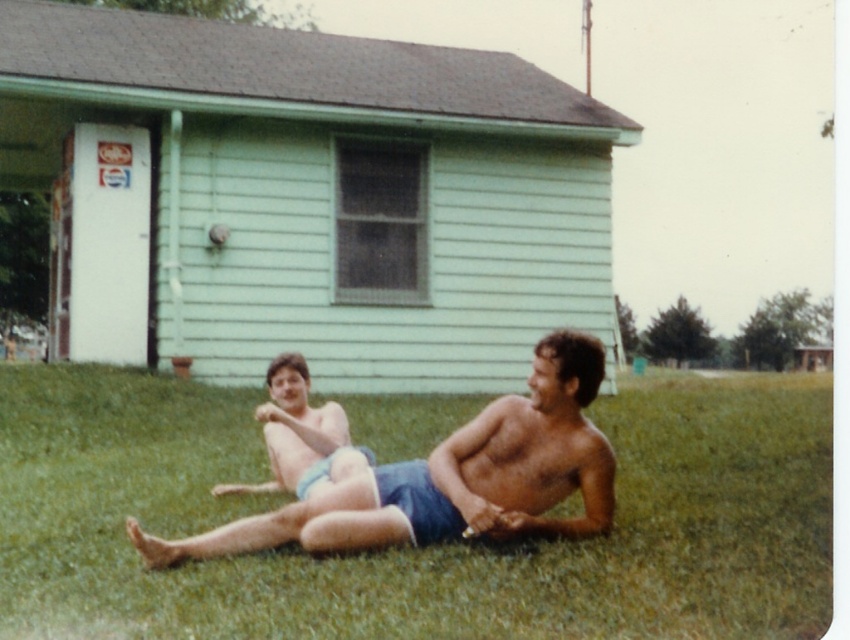
Question: Which object is farther from the camera taking this photo?

Choices:
 (A) blue fabric shorts at center
 (B) green grass at center

Answer: (A)

Question: Among these objects, which one is farthest from the camera?

Choices:
 (A) blue denim shorts at center
 (B) blue fabric shorts at center

Answer: (B)

Question: Does green grass at center have a lesser width compared to blue denim shorts at center?

Choices:
 (A) no
 (B) yes

Answer: (A)

Question: Which of the following is the farthest from the observer?

Choices:
 (A) (348, 452)
 (B) (381, 438)

Answer: (B)

Question: Does green grass at center lie behind blue fabric shorts at center?

Choices:
 (A) yes
 (B) no

Answer: (B)

Question: Is the position of blue denim shorts at center more distant than that of blue fabric shorts at center?

Choices:
 (A) yes
 (B) no

Answer: (B)